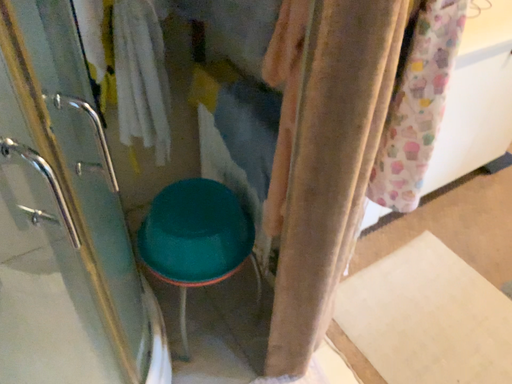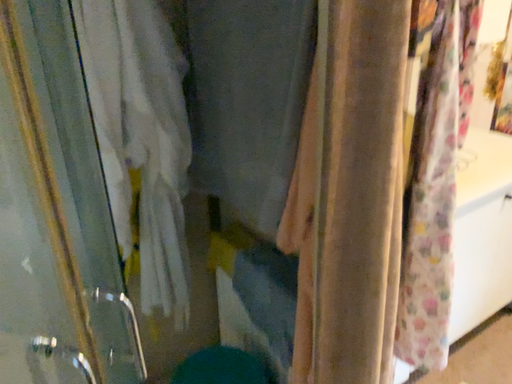
Question: How did the camera likely rotate when shooting the video?

Choices:
 (A) rotated upward
 (B) rotated downward

Answer: (A)